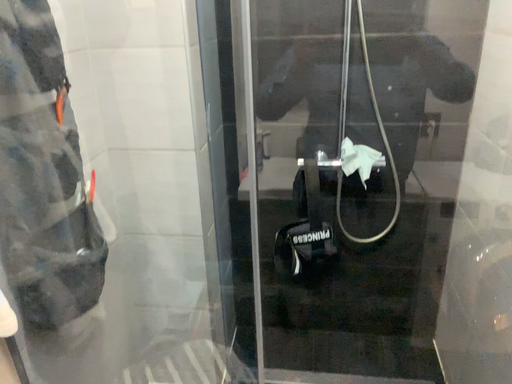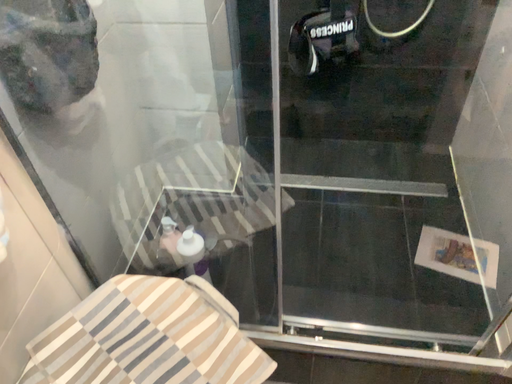
Question: How did the camera likely rotate when shooting the video?

Choices:
 (A) rotated upward
 (B) rotated downward

Answer: (B)